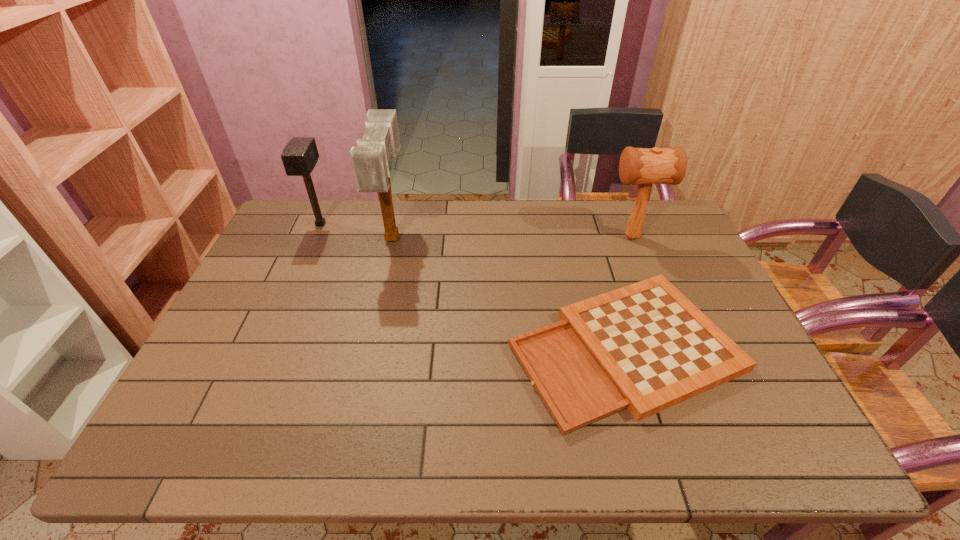
The height and width of the screenshot is (540, 960). What are the coordinates of `the tallest mallet` in the screenshot? It's located at (371, 159).

This screenshot has height=540, width=960. Find the location of `the second mallet from left to right`. the second mallet from left to right is located at coordinates (371, 159).

This screenshot has height=540, width=960. Find the location of `the rightmost mallet`. the rightmost mallet is located at coordinates (646, 166).

Identify the location of the leftmost object. The height and width of the screenshot is (540, 960). (300, 156).

I want to click on gameboard, so click(646, 347).

Identify the location of the shortest object. This screenshot has width=960, height=540. (646, 347).

Locate an element on the screen. Image resolution: width=960 pixels, height=540 pixels. vacant space located on the right of the second mallet from right to left is located at coordinates (452, 238).

Identify the location of vacant region located 0.370m on the strike surface of the rightmost mallet. The height and width of the screenshot is (540, 960). (494, 237).

Find the location of a particular element. This screenshot has height=540, width=960. vacant space situated 0.160m on the strike surface of the rightmost mallet is located at coordinates (557, 237).

Find the location of a particular element. The width and height of the screenshot is (960, 540). vacant area situated on the strike surface of the rightmost mallet is located at coordinates [x=584, y=237].